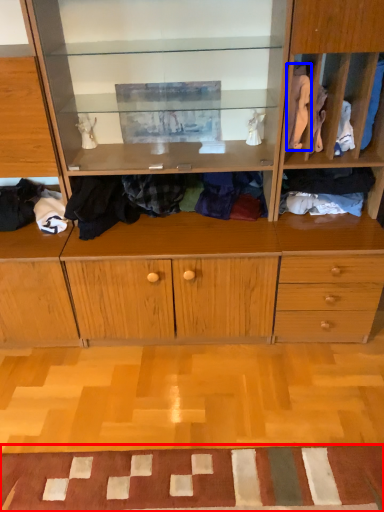
Question: Which point is closer to the camera, doormat (highlighted by a red box) or clothing (highlighted by a blue box)?

Choices:
 (A) doormat
 (B) clothing

Answer: (A)